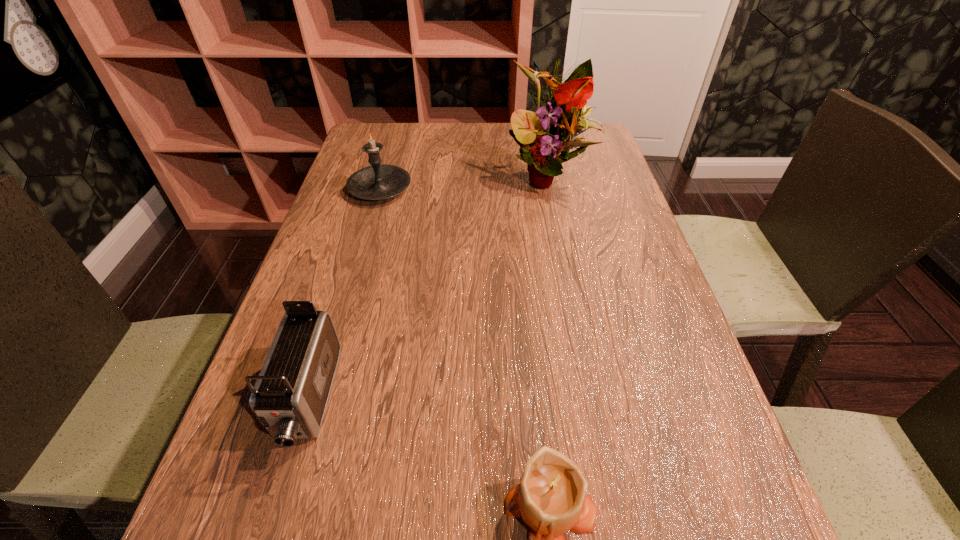
Locate an element on the screen. The height and width of the screenshot is (540, 960). object at the far right corner is located at coordinates (541, 140).

Where is `vacant space at the left edge of the desktop`? Image resolution: width=960 pixels, height=540 pixels. vacant space at the left edge of the desktop is located at coordinates (383, 230).

Locate an element on the screen. The width and height of the screenshot is (960, 540). free spot at the right edge of the desktop is located at coordinates (624, 190).

Locate an element on the screen. The image size is (960, 540). vacant space at the far left corner of the desktop is located at coordinates (409, 130).

The width and height of the screenshot is (960, 540). Find the location of `vacant space that's between the camcorder and the tallest object`. vacant space that's between the camcorder and the tallest object is located at coordinates (427, 288).

This screenshot has width=960, height=540. Find the location of `free space that is in between the third farthest object and the bouquet`. free space that is in between the third farthest object and the bouquet is located at coordinates (427, 288).

Where is `free area in between the tallest object and the taller candle`? free area in between the tallest object and the taller candle is located at coordinates (464, 183).

Find the location of a particular element. free space between the left candle and the third farthest object is located at coordinates (344, 294).

Find the location of a particular element. The width and height of the screenshot is (960, 540). blank region between the farther candle and the bouquet is located at coordinates (464, 183).

Locate an element on the screen. free space between the bouquet and the camcorder is located at coordinates (427, 288).